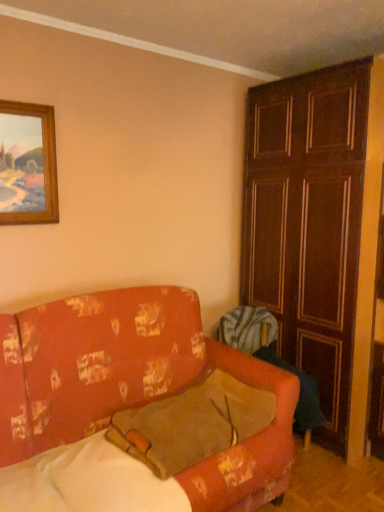
Question: Is wooden panelled door at right taller than floral-patterned fabric couch at lower left?

Choices:
 (A) yes
 (B) no

Answer: (A)

Question: Can you confirm if wooden panelled door at right is wider than floral-patterned fabric couch at lower left?

Choices:
 (A) no
 (B) yes

Answer: (A)

Question: Is wooden panelled door at right to the right of floral-patterned fabric couch at lower left from the viewer's perspective?

Choices:
 (A) no
 (B) yes

Answer: (B)

Question: Is floral-patterned fabric couch at lower left inside wooden panelled door at right?

Choices:
 (A) yes
 (B) no

Answer: (B)

Question: Does wooden panelled door at right have a smaller size compared to floral-patterned fabric couch at lower left?

Choices:
 (A) yes
 (B) no

Answer: (A)

Question: Is wooden panelled door at right to the left of floral-patterned fabric couch at lower left from the viewer's perspective?

Choices:
 (A) yes
 (B) no

Answer: (B)

Question: Is floral-patterned fabric couch at lower left placed right next to wooden picture frame at upper left?

Choices:
 (A) yes
 (B) no

Answer: (B)

Question: Is there a large distance between floral-patterned fabric couch at lower left and wooden picture frame at upper left?

Choices:
 (A) no
 (B) yes

Answer: (B)

Question: Considering the relative positions of floral-patterned fabric couch at lower left and wooden picture frame at upper left in the image provided, is floral-patterned fabric couch at lower left behind wooden picture frame at upper left?

Choices:
 (A) yes
 (B) no

Answer: (B)

Question: From the image's perspective, is floral-patterned fabric couch at lower left beneath wooden picture frame at upper left?

Choices:
 (A) yes
 (B) no

Answer: (A)

Question: Is floral-patterned fabric couch at lower left smaller than wooden picture frame at upper left?

Choices:
 (A) yes
 (B) no

Answer: (B)

Question: From a real-world perspective, does floral-patterned fabric couch at lower left stand above wooden picture frame at upper left?

Choices:
 (A) no
 (B) yes

Answer: (A)

Question: From a real-world perspective, is floral-patterned fabric couch at lower left under wooden panelled door at right?

Choices:
 (A) yes
 (B) no

Answer: (A)